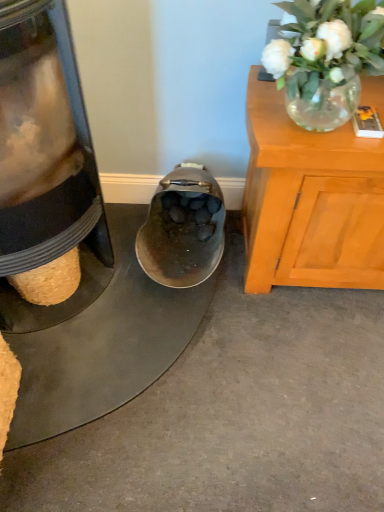
Question: In the image, is shiny metallic shoe at center on the left side or the right side of translucent glass vase at upper right?

Choices:
 (A) right
 (B) left

Answer: (B)

Question: Is point (150, 233) closer or farther from the camera than point (307, 84)?

Choices:
 (A) farther
 (B) closer

Answer: (A)

Question: Which object is positioned closest to the metallic bowl at center?

Choices:
 (A) shiny metallic shoe at center
 (B) translucent glass vase at upper right

Answer: (A)

Question: Which object is positioned farthest from the translucent glass vase at upper right?

Choices:
 (A) shiny metallic shoe at center
 (B) metallic bowl at center

Answer: (B)